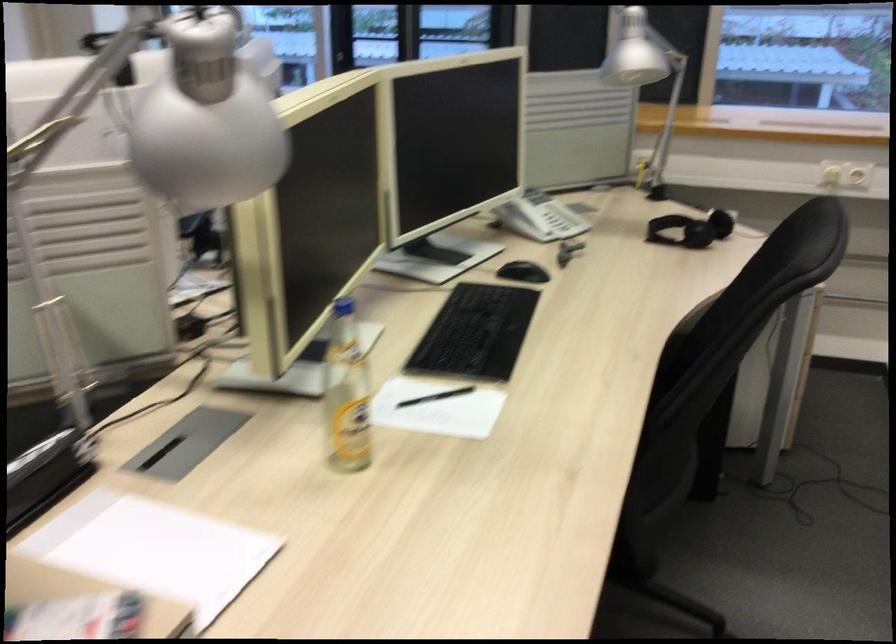
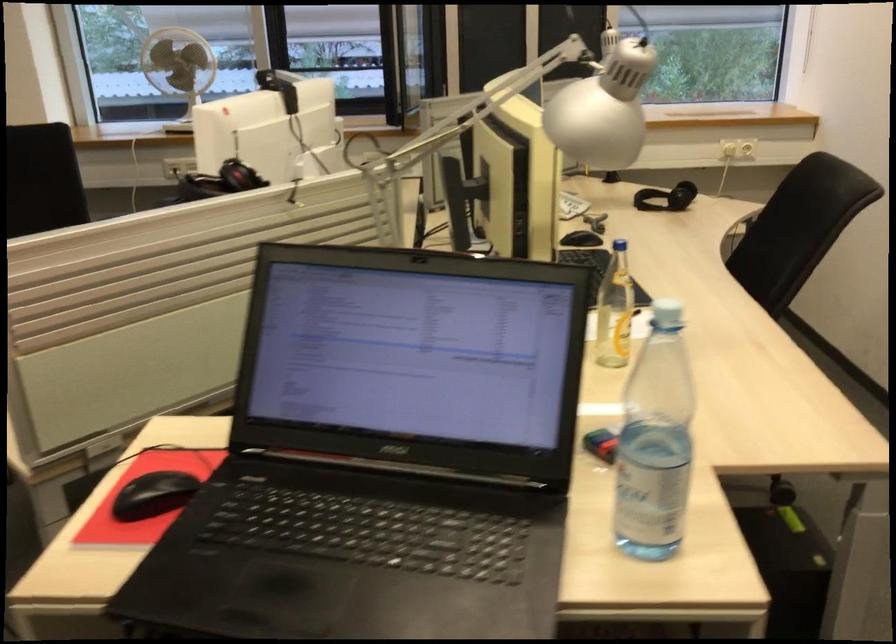
Find the pixel in the second image that matches (x=183, y=128) in the first image.

(604, 109)